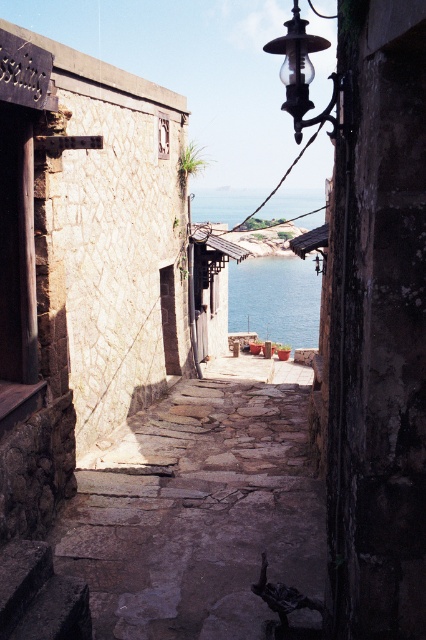
Question: Is rustic stone path at center to the left of clear glass lamp at upper right from the viewer's perspective?

Choices:
 (A) no
 (B) yes

Answer: (B)

Question: Which of these objects is positioned farthest from the rustic stone path at center?

Choices:
 (A) clear glass lamp at upper right
 (B) dark stone stairs at lower left
 (C) blue water at center

Answer: (A)

Question: Is dark stone stairs at lower left smaller than blue water at center?

Choices:
 (A) no
 (B) yes

Answer: (B)

Question: Does rustic stone path at center lie behind blue water at center?

Choices:
 (A) yes
 (B) no

Answer: (B)

Question: Which object appears closest to the camera in this image?

Choices:
 (A) dark stone stairs at lower left
 (B) rustic stone path at center
 (C) blue water at center
 (D) clear glass lamp at upper right

Answer: (A)

Question: Which object appears farthest from the camera in this image?

Choices:
 (A) blue water at center
 (B) rustic stone path at center
 (C) clear glass lamp at upper right

Answer: (A)